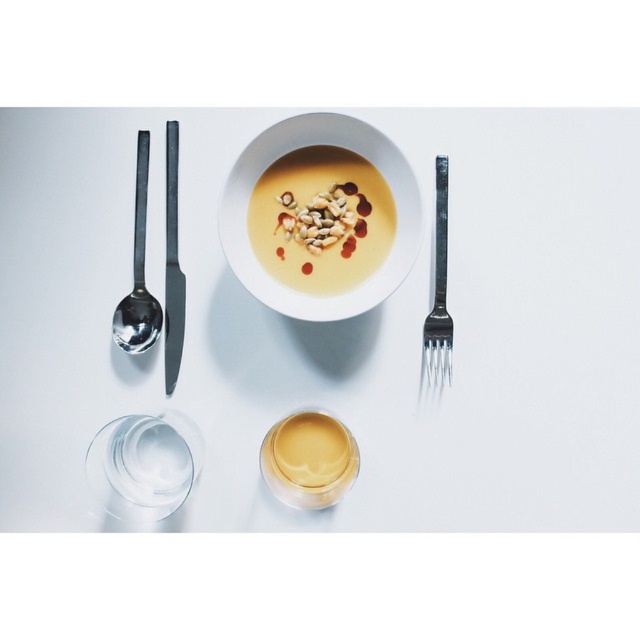
Question: Which point appears farthest from the camera in this image?

Choices:
 (A) (134, 180)
 (B) (440, 308)

Answer: (B)

Question: Which object appears farthest from the camera in this image?

Choices:
 (A) silver metallic fork at right
 (B) black matte knife at left

Answer: (B)

Question: Does white glossy bowl at center have a smaller size compared to black matte knife at left?

Choices:
 (A) no
 (B) yes

Answer: (A)

Question: Is yellow matte soup at center below smooth creamy soup with nuts at center?

Choices:
 (A) no
 (B) yes

Answer: (A)

Question: Which of these objects is positioned farthest from the yellow matte soup at center?

Choices:
 (A) black matte knife at left
 (B) white glossy bowl at center
 (C) silver metallic fork at right
 (D) smooth creamy soup with nuts at center

Answer: (A)

Question: Is white glossy bowl at center to the right of yellow matte soup at center from the viewer's perspective?

Choices:
 (A) no
 (B) yes

Answer: (A)